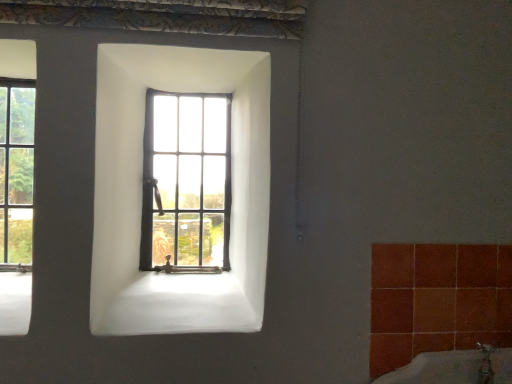
Find the location of a particular element. The height and width of the screenshot is (384, 512). free space in front of wooden-framed window at center, which is the 2th window from left to right is located at coordinates [x=175, y=280].